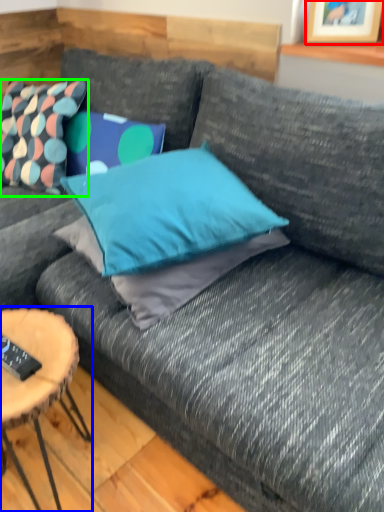
Question: Estimate the real-world distances between objects in this image. Which object is farther from picture frame (highlighted by a red box), coffee table (highlighted by a blue box) or pillow (highlighted by a green box)?

Choices:
 (A) coffee table
 (B) pillow

Answer: (A)